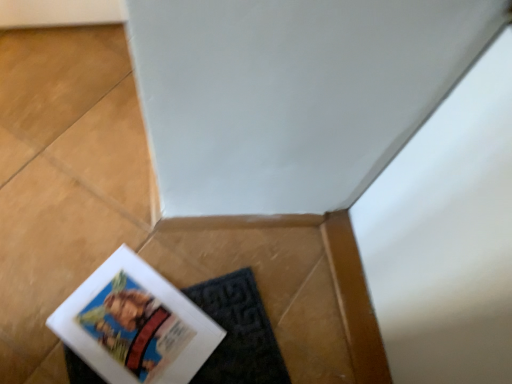
What are the coordinates of `free location above white matte book at lower left (from a real-world perspective)` in the screenshot? It's located at (138, 320).